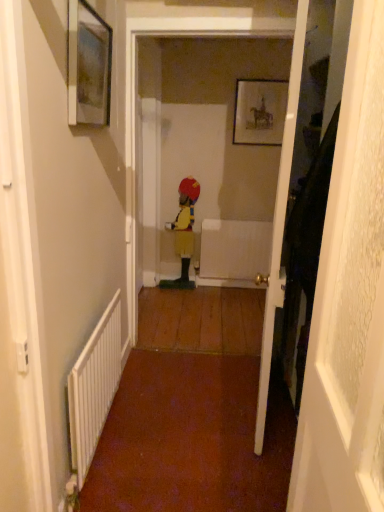
Question: From a real-world perspective, is white metallic radiator at lower left beneath yellow fabric figure at center?

Choices:
 (A) yes
 (B) no

Answer: (A)

Question: Is white metallic radiator at lower left positioned in front of yellow fabric figure at center?

Choices:
 (A) yes
 (B) no

Answer: (A)

Question: Is the position of white metallic radiator at lower left more distant than that of yellow fabric figure at center?

Choices:
 (A) no
 (B) yes

Answer: (A)

Question: Is yellow fabric figure at center inside white metallic radiator at lower left?

Choices:
 (A) no
 (B) yes

Answer: (A)

Question: Can you confirm if white metallic radiator at lower left is taller than yellow fabric figure at center?

Choices:
 (A) no
 (B) yes

Answer: (A)

Question: Is white metallic radiator at lower left smaller than yellow fabric figure at center?

Choices:
 (A) yes
 (B) no

Answer: (A)

Question: From a real-world perspective, is matte black picture frame at upper center, the 1th picture frame in the top-to-bottom sequence, physically below wooden door at right, which is the second door from front to back?

Choices:
 (A) no
 (B) yes

Answer: (A)

Question: Is matte black picture frame at upper center, the 1th picture frame when ordered from right to left, not inside wooden door at right, which is the second door from front to back?

Choices:
 (A) yes
 (B) no

Answer: (A)

Question: Is matte black picture frame at upper center, the 1th picture frame when ordered from right to left, turned away from wooden door at right, the first door positioned from the back?

Choices:
 (A) yes
 (B) no

Answer: (B)

Question: Is matte black picture frame at upper center, the 1th picture frame in the top-to-bottom sequence, at the left side of wooden door at right, which is the second door from front to back?

Choices:
 (A) yes
 (B) no

Answer: (B)

Question: Considering the relative positions of matte black picture frame at upper center, the second picture frame from the left, and wooden door at right, the first door positioned from the back, in the image provided, is matte black picture frame at upper center, the second picture frame from the left, in front of wooden door at right, the first door positioned from the back,?

Choices:
 (A) no
 (B) yes

Answer: (A)

Question: Considering the relative sizes of matte black picture frame at upper center, the 1th picture frame when ordered from right to left, and wooden door at right, the first door positioned from the back, in the image provided, is matte black picture frame at upper center, the 1th picture frame when ordered from right to left, smaller than wooden door at right, the first door positioned from the back,?

Choices:
 (A) no
 (B) yes

Answer: (B)

Question: From a real-world perspective, is wooden door at right, which is the second door from front to back, on white metallic radiator at lower left?

Choices:
 (A) yes
 (B) no

Answer: (A)